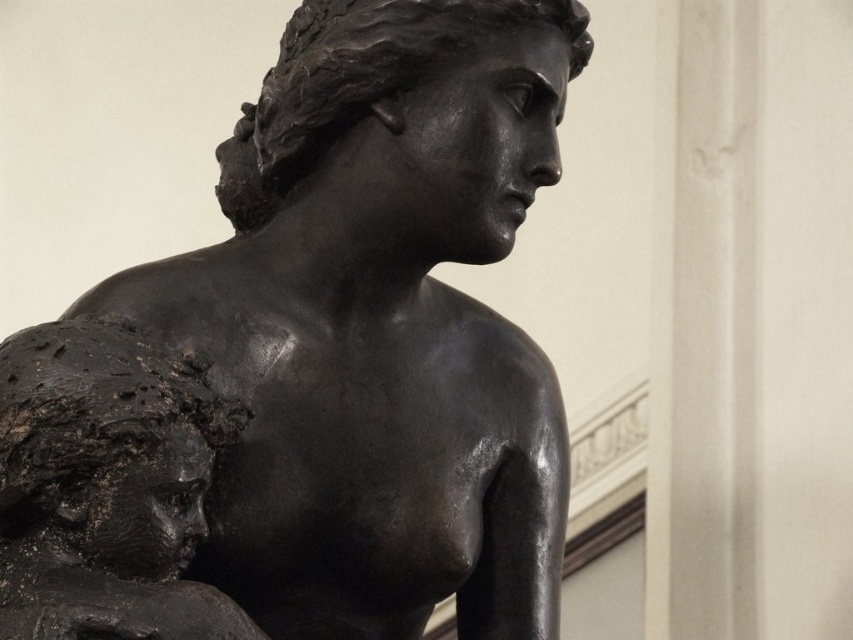
You are an art curator arranging a gallery layout. You need to ensure that the shiny bronze statue at center and the matte black bust at left are visible from the main entrance. Based on their current positions, which object will be more visible from the entrance?

The shiny bronze statue at center is located above the matte black bust at left, so it will be more visible from the entrance because it is positioned higher up.

You are an art curator arranging an exhibition. You have a shiny bronze statue at center and a matte black bust at left. Which object should you place on the right side of the exhibition if you want the wider object to be on the right?

The shiny bronze statue at center might be wider than matte black bust at left, so you should place the shiny bronze statue at center on the right side of the exhibition.

You are an art conservator examining the sculpture arrangement. You need to determine the spatial relationship between the shiny bronze statue at center and the matte black bust at left. Which object is closer to you as you stand in front of the artwork?

The shiny bronze statue at center is closer to you than the matte black bust at left.